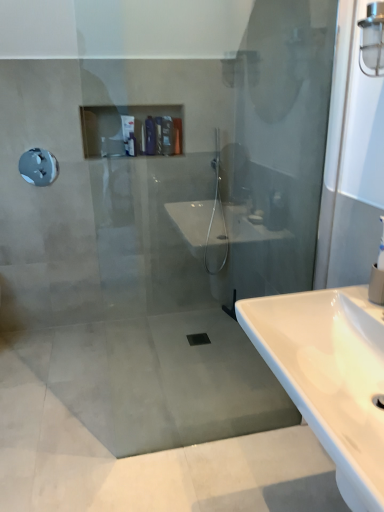
What is the approximate height of matte plastic toiletries at upper center, the 1th toiletry when ordered from right to left?

20.40 centimeters.

Describe the element at coordinates (127, 128) in the screenshot. The image size is (384, 512). I see `white glossy bottle at upper left, which is the 3th toiletry from right to left` at that location.

You are a GUI agent. You are given a task and a screenshot of the screen. Output one action in this format:
    pyautogui.click(x=<x>, y=<y>)
    Task: Click on the matte plastic shampoo bottle at upper center, marked as the 2th toiletry in a left-to-right arrangement
    Image resolution: width=384 pixels, height=512 pixels.
    Given the screenshot: What is the action you would take?
    pyautogui.click(x=167, y=135)

Where is `metallic gray showerhead at upper left`? The image size is (384, 512). metallic gray showerhead at upper left is located at coordinates (38, 167).

Could you tell me if metallic gray showerhead at upper left is facing matte plastic toiletries at upper center, the 1th toiletry when ordered from right to left?

No, metallic gray showerhead at upper left is not oriented towards matte plastic toiletries at upper center, the 1th toiletry when ordered from right to left.

How many degrees apart are the facing directions of metallic gray showerhead at upper left and matte plastic toiletries at upper center, the 1th toiletry when ordered from right to left?

The angle between the facing direction of metallic gray showerhead at upper left and the facing direction of matte plastic toiletries at upper center, the 1th toiletry when ordered from right to left, is 0.352 degrees.

Would you say metallic gray showerhead at upper left is to the left or to the right of matte plastic toiletries at upper center, the third toiletry when ordered from left to right, in the picture?

From the image, it's evident that metallic gray showerhead at upper left is to the left of matte plastic toiletries at upper center, the third toiletry when ordered from left to right.

Is point (37, 157) less distant than point (177, 150)?

Yes.

Is matte plastic toiletries at upper center, the 1th toiletry when ordered from right to left, not within white glossy sink at lower right?

Absolutely, matte plastic toiletries at upper center, the 1th toiletry when ordered from right to left, is external to white glossy sink at lower right.

From the image's perspective, which is above, matte plastic toiletries at upper center, the 1th toiletry when ordered from right to left, or white glossy sink at lower right?

matte plastic toiletries at upper center, the 1th toiletry when ordered from right to left.

What's the angular difference between matte plastic toiletries at upper center, the 1th toiletry when ordered from right to left, and white glossy sink at lower right's facing directions?

91.4 degrees.

Considering the relative sizes of matte plastic toiletries at upper center, the third toiletry when ordered from left to right, and white glossy sink at lower right in the image provided, is matte plastic toiletries at upper center, the third toiletry when ordered from left to right, bigger than white glossy sink at lower right?

No, matte plastic toiletries at upper center, the third toiletry when ordered from left to right, is not bigger than white glossy sink at lower right.

Is there a large distance between matte plastic toiletries at upper center, the 1th toiletry when ordered from right to left, and clear glass light fixture at upper right?

Indeed, matte plastic toiletries at upper center, the 1th toiletry when ordered from right to left, is not near clear glass light fixture at upper right.

From the image's perspective, which object appears higher, matte plastic toiletries at upper center, the 1th toiletry when ordered from right to left, or clear glass light fixture at upper right?

matte plastic toiletries at upper center, the 1th toiletry when ordered from right to left, appears higher in the image.

From a real-world perspective, is matte plastic toiletries at upper center, the third toiletry when ordered from left to right, below clear glass light fixture at upper right?

Yes, from a real-world perspective, matte plastic toiletries at upper center, the third toiletry when ordered from left to right, is beneath clear glass light fixture at upper right.

Based on the photo, is matte plastic toiletries at upper center, the 1th toiletry when ordered from right to left, completely or partially outside of clear glass light fixture at upper right?

matte plastic toiletries at upper center, the 1th toiletry when ordered from right to left, is positioned outside clear glass light fixture at upper right.

Relative to white glossy bottle at upper left, positioned as the 1th toiletry in left-to-right order, is white glossy sink at lower right in front or behind?

white glossy sink at lower right is in front of white glossy bottle at upper left, positioned as the 1th toiletry in left-to-right order.

Which is more to the left, white glossy sink at lower right or white glossy bottle at upper left, which is the 3th toiletry from right to left?

white glossy bottle at upper left, which is the 3th toiletry from right to left, is more to the left.

From their relative heights in the image, would you say white glossy sink at lower right is taller or shorter than white glossy bottle at upper left, which is the 3th toiletry from right to left?

white glossy sink at lower right is shorter than white glossy bottle at upper left, which is the 3th toiletry from right to left.

Which object is positioned more to the left, clear glass light fixture at upper right or matte plastic shampoo bottle at upper center, placed as the second toiletry when sorted from right to left?

Positioned to the left is matte plastic shampoo bottle at upper center, placed as the second toiletry when sorted from right to left.

Starting from the clear glass light fixture at upper right, which toiletry is the 2nd one to the left? Please provide its 2D coordinates.

[(167, 135)]

Considering the sizes of clear glass light fixture at upper right and matte plastic shampoo bottle at upper center, marked as the 2th toiletry in a left-to-right arrangement, in the image, is clear glass light fixture at upper right taller or shorter than matte plastic shampoo bottle at upper center, marked as the 2th toiletry in a left-to-right arrangement,?

Result: In the image, clear glass light fixture at upper right appears to be taller than matte plastic shampoo bottle at upper center, marked as the 2th toiletry in a left-to-right arrangement.

Is clear glass light fixture at upper right positioned beyond the bounds of matte plastic shampoo bottle at upper center, placed as the second toiletry when sorted from right to left?

Yes, clear glass light fixture at upper right is not within matte plastic shampoo bottle at upper center, placed as the second toiletry when sorted from right to left.

Does white glossy bottle at upper left, which is the 3th toiletry from right to left, turn towards matte plastic shampoo bottle at upper center, placed as the second toiletry when sorted from right to left?

No, white glossy bottle at upper left, which is the 3th toiletry from right to left, is not facing towards matte plastic shampoo bottle at upper center, placed as the second toiletry when sorted from right to left.

From a real-world perspective, between white glossy bottle at upper left, positioned as the 1th toiletry in left-to-right order, and matte plastic shampoo bottle at upper center, marked as the 2th toiletry in a left-to-right arrangement, who is vertically higher?

white glossy bottle at upper left, positioned as the 1th toiletry in left-to-right order, from a real-world perspective.

How distant is white glossy bottle at upper left, positioned as the 1th toiletry in left-to-right order, from matte plastic shampoo bottle at upper center, marked as the 2th toiletry in a left-to-right arrangement?

A distance of 29.89 inches exists between white glossy bottle at upper left, positioned as the 1th toiletry in left-to-right order, and matte plastic shampoo bottle at upper center, marked as the 2th toiletry in a left-to-right arrangement.

Is the surface of white glossy sink at lower right in direct contact with matte plastic toiletries at upper center, the 1th toiletry when ordered from right to left?

No, white glossy sink at lower right is not next to matte plastic toiletries at upper center, the 1th toiletry when ordered from right to left.

Can matte plastic toiletries at upper center, the third toiletry when ordered from left to right, be found inside white glossy sink at lower right?

No.

Which of these two, white glossy sink at lower right or matte plastic toiletries at upper center, the 1th toiletry when ordered from right to left, stands shorter?

Standing shorter between the two is white glossy sink at lower right.

Image resolution: width=384 pixels, height=512 pixels. Identify the location of shower located on the left of matte plastic toiletries at upper center, the third toiletry when ordered from left to right. (38, 167).

Image resolution: width=384 pixels, height=512 pixels. What are the coordinates of `sink below the matte plastic toiletries at upper center, the third toiletry when ordered from left to right (from a real-world perspective)` in the screenshot? It's located at (330, 376).

Estimate the real-world distances between objects in this image. Which object is closer to white glossy sink at lower right, matte plastic toiletries at upper center, the third toiletry when ordered from left to right, or metallic gray showerhead at upper left?

Among the two, matte plastic toiletries at upper center, the third toiletry when ordered from left to right, is located nearer to white glossy sink at lower right.

When comparing their distances from metallic gray showerhead at upper left, does matte plastic shampoo bottle at upper center, marked as the 2th toiletry in a left-to-right arrangement, or white glossy sink at lower right seem further?

white glossy sink at lower right lies further to metallic gray showerhead at upper left than the other object.

Looking at the image, which one is located closer to matte plastic toiletries at upper center, the third toiletry when ordered from left to right, matte plastic shampoo bottle at upper center, placed as the second toiletry when sorted from right to left, or clear glass light fixture at upper right?

matte plastic shampoo bottle at upper center, placed as the second toiletry when sorted from right to left, lies closer to matte plastic toiletries at upper center, the third toiletry when ordered from left to right, than the other object.

Looking at the image, which one is located closer to matte plastic toiletries at upper center, the third toiletry when ordered from left to right, metallic gray showerhead at upper left or white glossy bottle at upper left, positioned as the 1th toiletry in left-to-right order?

metallic gray showerhead at upper left lies closer to matte plastic toiletries at upper center, the third toiletry when ordered from left to right, than the other object.

Looking at the image, which one is located further to matte plastic shampoo bottle at upper center, marked as the 2th toiletry in a left-to-right arrangement, white glossy sink at lower right or metallic gray showerhead at upper left?

Among the two, white glossy sink at lower right is located further to matte plastic shampoo bottle at upper center, marked as the 2th toiletry in a left-to-right arrangement.

Considering their positions, is matte plastic toiletries at upper center, the third toiletry when ordered from left to right, positioned closer to clear glass light fixture at upper right than metallic gray showerhead at upper left?

matte plastic toiletries at upper center, the third toiletry when ordered from left to right, is closer to clear glass light fixture at upper right.

Estimate the real-world distances between objects in this image. Which object is closer to clear glass light fixture at upper right, matte plastic shampoo bottle at upper center, placed as the second toiletry when sorted from right to left, or white glossy bottle at upper left, which is the 3th toiletry from right to left?

white glossy bottle at upper left, which is the 3th toiletry from right to left, is closer to clear glass light fixture at upper right.

Which object lies nearer to the anchor point white glossy sink at lower right, white glossy bottle at upper left, which is the 3th toiletry from right to left, or matte plastic shampoo bottle at upper center, marked as the 2th toiletry in a left-to-right arrangement?

white glossy bottle at upper left, which is the 3th toiletry from right to left.

The image size is (384, 512). What are the coordinates of `light fixture between white glossy sink at lower right and matte plastic shampoo bottle at upper center, marked as the 2th toiletry in a left-to-right arrangement, in the front-back direction` in the screenshot? It's located at (372, 41).

Image resolution: width=384 pixels, height=512 pixels. In order to click on light fixture positioned between white glossy sink at lower right and white glossy bottle at upper left, positioned as the 1th toiletry in left-to-right order, from near to far in this screenshot , I will do `click(372, 41)`.

Find the location of `shower between white glossy sink at lower right and matte plastic toiletries at upper center, the third toiletry when ordered from left to right, from front to back`. shower between white glossy sink at lower right and matte plastic toiletries at upper center, the third toiletry when ordered from left to right, from front to back is located at coordinates (38, 167).

The height and width of the screenshot is (512, 384). Identify the location of toiletry situated between white glossy bottle at upper left, positioned as the 1th toiletry in left-to-right order, and matte plastic toiletries at upper center, the 1th toiletry when ordered from right to left, from left to right. (167, 135).